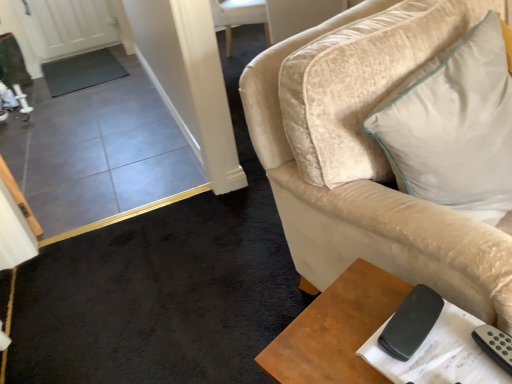
Describe the element at coordinates (411, 323) in the screenshot. I see `black matte remote at lower right` at that location.

Describe the element at coordinates (454, 126) in the screenshot. The width and height of the screenshot is (512, 384). I see `white soft cushion at upper right` at that location.

Locate an element on the screen. brown wooden table at lower right is located at coordinates (336, 330).

Is white soft cushion at upper right oriented away from black matte remote at lower right?

white soft cushion at upper right is not turned away from black matte remote at lower right.

Considering the relative sizes of white soft cushion at upper right and black matte remote at lower right in the image provided, is white soft cushion at upper right bigger than black matte remote at lower right?

Correct, white soft cushion at upper right is larger in size than black matte remote at lower right.

The height and width of the screenshot is (384, 512). What are the coordinates of `pillow located above the black matte remote at lower right (from a real-world perspective)` in the screenshot? It's located at (454, 126).

Between white soft cushion at upper right and black matte remote at lower right, which one has less height?

black matte remote at lower right.

Locate an element on the screen. This screenshot has height=384, width=512. remote located behind the brown wooden table at lower right is located at coordinates (411, 323).

Is black matte remote at lower right taller than brown wooden table at lower right?

Incorrect, the height of black matte remote at lower right is not larger of that of brown wooden table at lower right.

Is point (393, 343) behind point (295, 370)?

Yes, it is.

Is black matte remote at lower right to the left or to the right of brown wooden table at lower right in the image?

black matte remote at lower right is positioned on brown wooden table at lower right's right side.

Who is bigger, brown wooden table at lower right or white soft cushion at upper right?

white soft cushion at upper right is bigger.

Consider the image. Which of these two, brown wooden table at lower right or white soft cushion at upper right, stands taller?

brown wooden table at lower right is taller.

Considering the relative positions of brown wooden table at lower right and white soft cushion at upper right in the image provided, is brown wooden table at lower right in front of white soft cushion at upper right?

That is True.

What are the coordinates of `table in front of the white soft cushion at upper right` in the screenshot? It's located at (336, 330).

In terms of width, does black matte remote at lower right look wider or thinner when compared to white soft cushion at upper right?

black matte remote at lower right is thinner than white soft cushion at upper right.

Image resolution: width=512 pixels, height=384 pixels. Identify the location of remote that appears on the left of white soft cushion at upper right. (411, 323).

Between black matte remote at lower right and white soft cushion at upper right, which one appears on the left side from the viewer's perspective?

black matte remote at lower right is more to the left.

Which is behind, point (475, 189) or point (280, 366)?

The point (475, 189) is farther.

In terms of height, does white soft cushion at upper right look taller or shorter compared to brown wooden table at lower right?

In the image, white soft cushion at upper right appears to be shorter than brown wooden table at lower right.

Does white soft cushion at upper right contain brown wooden table at lower right?

Definitely not — brown wooden table at lower right is not inside white soft cushion at upper right.

Considering the relative sizes of white soft cushion at upper right and brown wooden table at lower right in the image provided, is white soft cushion at upper right thinner than brown wooden table at lower right?

No, white soft cushion at upper right is not thinner than brown wooden table at lower right.

Is point (266, 364) closer or farther from the camera than point (399, 351)?

Point (266, 364).

Which object is positioned more to the left, brown wooden table at lower right or black matte remote at lower right?

From the viewer's perspective, brown wooden table at lower right appears more on the left side.

Based on the photo, which of these two, brown wooden table at lower right or black matte remote at lower right, is thinner?

Thinner between the two is black matte remote at lower right.

Does brown wooden table at lower right lie in front of black matte remote at lower right?

Yes, brown wooden table at lower right is in front of black matte remote at lower right.

I want to click on pillow that is above the black matte remote at lower right (from a real-world perspective), so click(454, 126).

Find the location of a particular element. Image resolution: width=512 pixels, height=384 pixels. table in front of the black matte remote at lower right is located at coordinates (336, 330).

When comparing their distances from white soft cushion at upper right, does black matte remote at lower right or brown wooden table at lower right seem further?

brown wooden table at lower right.

Estimate the real-world distances between objects in this image. Which object is closer to brown wooden table at lower right, black matte remote at lower right or white soft cushion at upper right?

black matte remote at lower right.

From the image, which object appears to be farther from brown wooden table at lower right, white soft cushion at upper right or black matte remote at lower right?

Among the two, white soft cushion at upper right is located further to brown wooden table at lower right.

Considering their positions, is brown wooden table at lower right positioned further to black matte remote at lower right than white soft cushion at upper right?

white soft cushion at upper right is positioned further to the anchor black matte remote at lower right.

Estimate the real-world distances between objects in this image. Which object is further from black matte remote at lower right, white soft cushion at upper right or brown wooden table at lower right?

white soft cushion at upper right is positioned further to the anchor black matte remote at lower right.

Considering their positions, is brown wooden table at lower right positioned closer to white soft cushion at upper right than black matte remote at lower right?

black matte remote at lower right lies closer to white soft cushion at upper right than the other object.

Identify the location of remote between white soft cushion at upper right and brown wooden table at lower right in the vertical direction. This screenshot has width=512, height=384. [x=411, y=323].